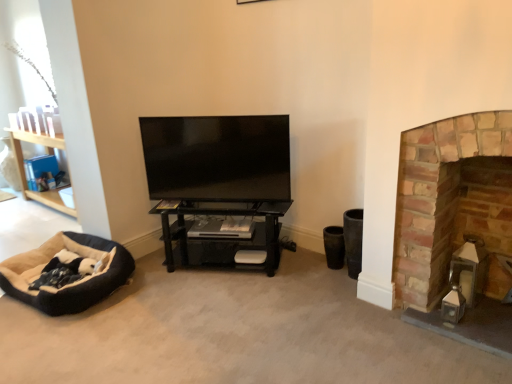
Question: Is brick fireplace at right behind flat screen tv at center?

Choices:
 (A) yes
 (B) no

Answer: (B)

Question: Can you confirm if brick fireplace at right is shorter than flat screen tv at center?

Choices:
 (A) yes
 (B) no

Answer: (B)

Question: From a real-world perspective, is brick fireplace at right positioned over flat screen tv at center based on gravity?

Choices:
 (A) yes
 (B) no

Answer: (B)

Question: Does brick fireplace at right have a larger size compared to flat screen tv at center?

Choices:
 (A) yes
 (B) no

Answer: (A)

Question: Considering the relative positions of brick fireplace at right and flat screen tv at center in the image provided, is brick fireplace at right in front of flat screen tv at center?

Choices:
 (A) yes
 (B) no

Answer: (A)

Question: Visually, is flat screen tv at center positioned to the left or to the right of soft beige fabric dog bed at lower left?

Choices:
 (A) right
 (B) left

Answer: (A)

Question: Is flat screen tv at center bigger or smaller than soft beige fabric dog bed at lower left?

Choices:
 (A) big
 (B) small

Answer: (B)

Question: From the image's perspective, is flat screen tv at center above or below soft beige fabric dog bed at lower left?

Choices:
 (A) above
 (B) below

Answer: (A)

Question: Is flat screen tv at center taller or shorter than soft beige fabric dog bed at lower left?

Choices:
 (A) short
 (B) tall

Answer: (B)

Question: Visually, is soft beige fabric dog bed at lower left positioned to the left or to the right of brick fireplace at right?

Choices:
 (A) right
 (B) left

Answer: (B)

Question: In the image, is soft beige fabric dog bed at lower left positioned in front of or behind brick fireplace at right?

Choices:
 (A) front
 (B) behind

Answer: (B)

Question: From a real-world perspective, relative to brick fireplace at right, is soft beige fabric dog bed at lower left vertically above or below?

Choices:
 (A) below
 (B) above

Answer: (A)

Question: Which is correct: soft beige fabric dog bed at lower left is inside brick fireplace at right, or outside of it?

Choices:
 (A) outside
 (B) inside

Answer: (A)

Question: In terms of width, does black matte shelf at center look wider or thinner when compared to flat screen tv at center?

Choices:
 (A) thin
 (B) wide

Answer: (B)

Question: From their relative heights in the image, would you say black matte shelf at center is taller or shorter than flat screen tv at center?

Choices:
 (A) tall
 (B) short

Answer: (B)